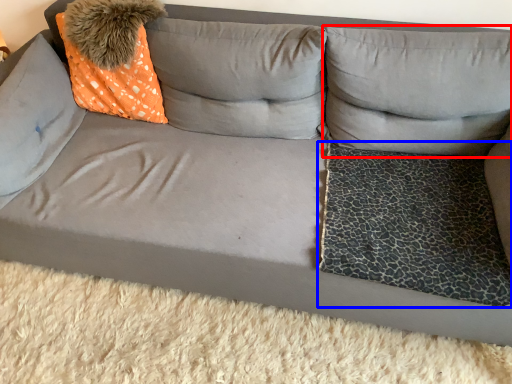
Question: Which object appears closest to the camera in this image, pillow (highlighted by a red box) or dog bed (highlighted by a blue box)?

Choices:
 (A) pillow
 (B) dog bed

Answer: (B)